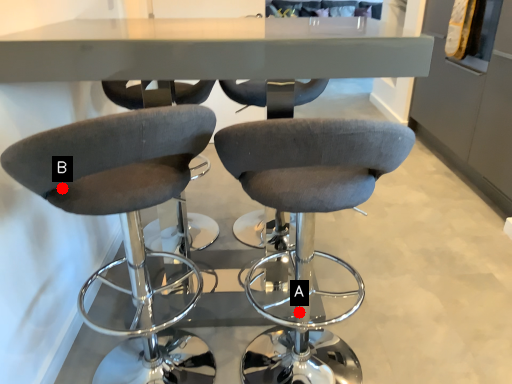
Question: Two points are circled on the image, labeled by A and B beside each circle. Which point is closer to the camera?

Choices:
 (A) A is closer
 (B) B is closer

Answer: (B)